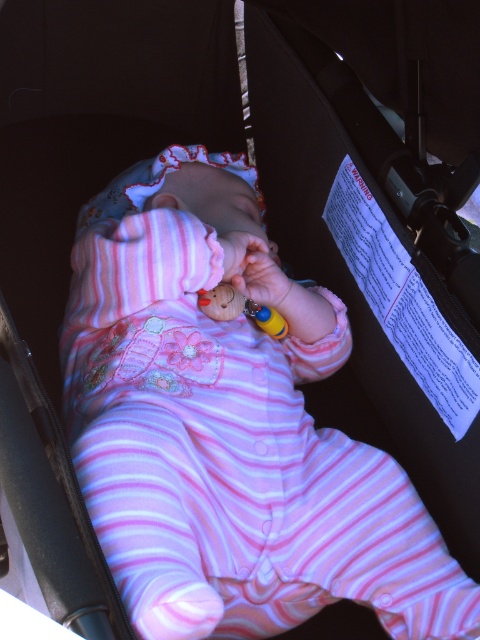
Question: Which of the following is the farthest from the observer?

Choices:
 (A) (218, 292)
 (B) (335, 310)
 (C) (245, 307)

Answer: (B)

Question: Is pink striped fabric baby at center further to camera compared to rubber teething ring at center?

Choices:
 (A) yes
 (B) no

Answer: (B)

Question: Which of the following is the closest to the observer?

Choices:
 (A) (249, 314)
 (B) (372, 445)
 (C) (263, 308)

Answer: (B)

Question: Is pink striped fabric baby at center positioned at the back of rubber teething ring at center?

Choices:
 (A) no
 (B) yes

Answer: (A)

Question: Does pink striped fabric baby at center have a smaller size compared to wooden toy at center?

Choices:
 (A) yes
 (B) no

Answer: (B)

Question: Estimate the real-world distances between objects in this image. Which object is closer to the wooden toy at center?

Choices:
 (A) rubber teething ring at center
 (B) pink striped fabric baby at center

Answer: (A)